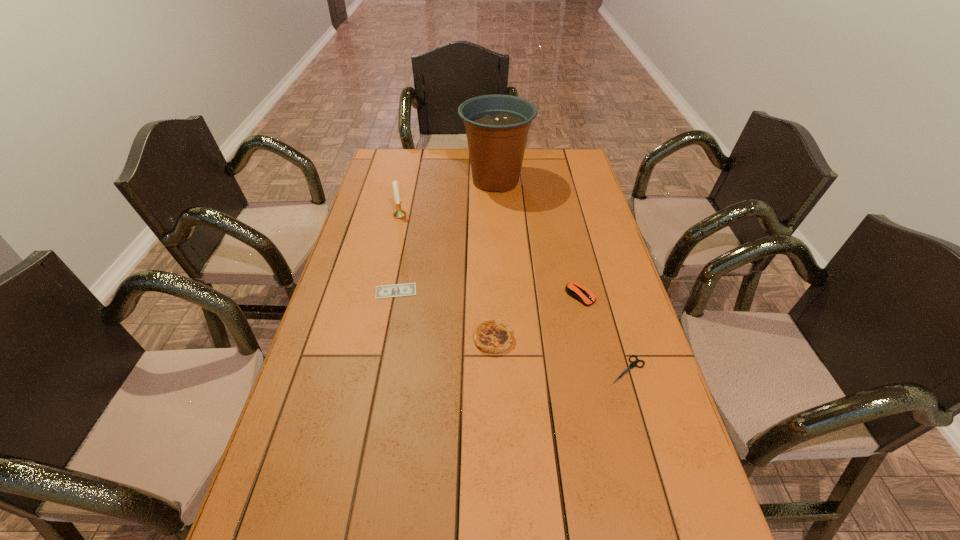
Where is `vacant area that lies between the computer mouse and the shears`? vacant area that lies between the computer mouse and the shears is located at coordinates (604, 333).

The image size is (960, 540). I want to click on object that can be found as the closest to the money, so click(491, 336).

Choose which object is the nearest neighbor to the quiche. Please provide its 2D coordinates. Your answer should be formatted as a tuple, i.e. [(x, y)], where the tuple contains the x and y coordinates of a point satisfying the conditions above.

[(576, 290)]

Locate an element on the screen. free location that satisfies the following two spatial constraints: 1. on the front side of the farthest object; 2. on the right side of the fifth tallest object is located at coordinates (505, 369).